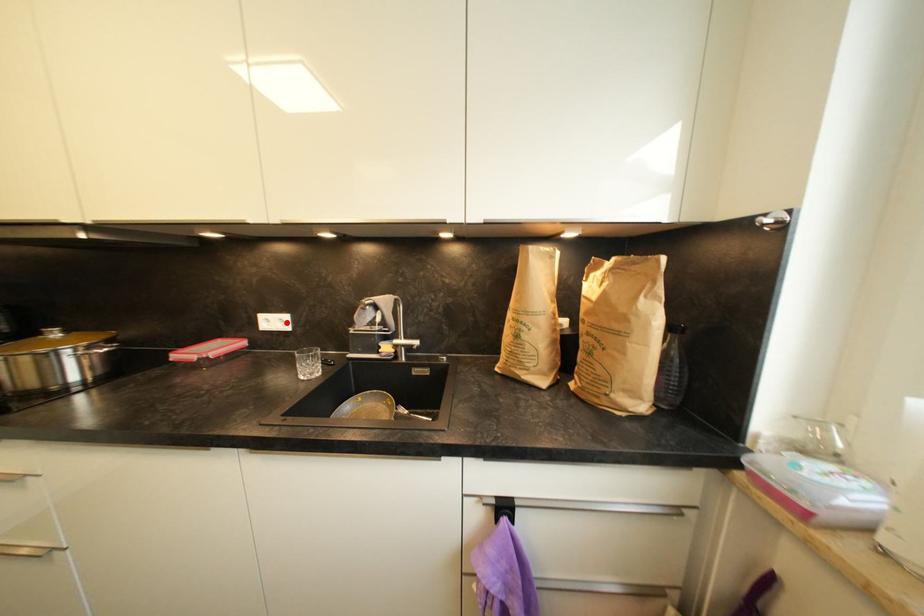
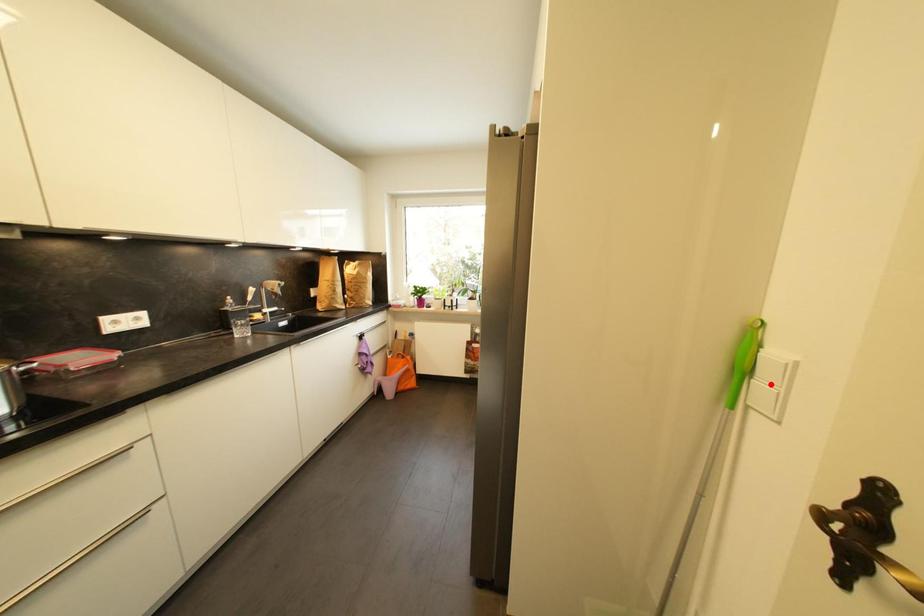
I am providing you with two images of the same scene from different viewpoints. A red point is marked on the first image and another point is marked on the second image. Are the points marked in image1 and image2 representing the same 3D position?

No